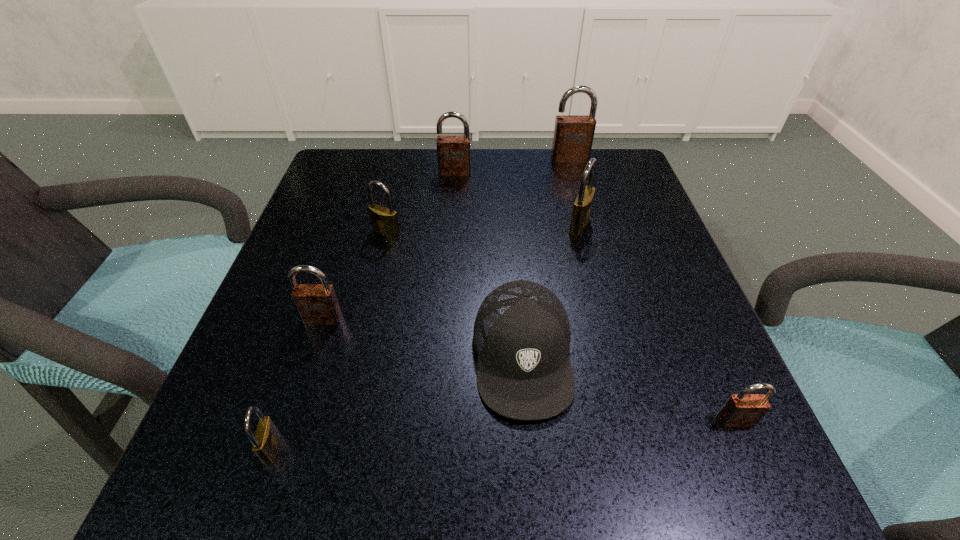
The image size is (960, 540). Identify the location of vacant space located 0.080m on the right of the nearest object. (341, 448).

The height and width of the screenshot is (540, 960). Identify the location of vacant space located on the front-facing side of the smallest brown padlock. (761, 481).

At what (x,y) coordinates should I click in order to perform the action: click on object positioned at the near edge. Please return your answer as a coordinate pair (x, y). Looking at the image, I should click on (266, 440).

Find the location of a particular element. This screenshot has height=540, width=960. object located at the near left corner is located at coordinates (266, 440).

I want to click on object present at the far right corner, so click(573, 136).

Find the location of a particular element. The image size is (960, 540). free space at the far edge is located at coordinates (435, 199).

In the image, there is a desktop. What are the coordinates of `blank space at the near edge` in the screenshot? It's located at (324, 469).

Find the location of a particular element. The image size is (960, 540). blank space at the left edge of the desktop is located at coordinates (293, 329).

Where is `vacant point at the right edge`? The height and width of the screenshot is (540, 960). vacant point at the right edge is located at coordinates (630, 256).

Locate an element on the screen. The image size is (960, 540). vacant space at the far left corner of the desktop is located at coordinates tap(383, 183).